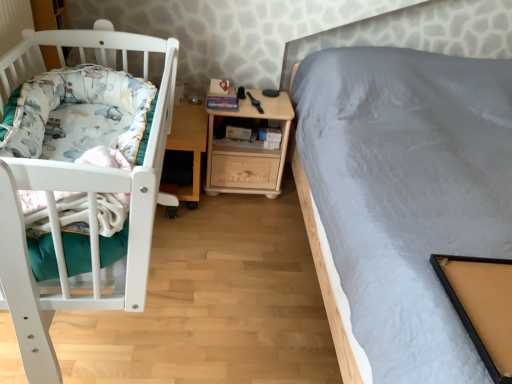
The height and width of the screenshot is (384, 512). In order to click on vacant area that is in front of wooden nightstand at center in this screenshot , I will do `click(241, 218)`.